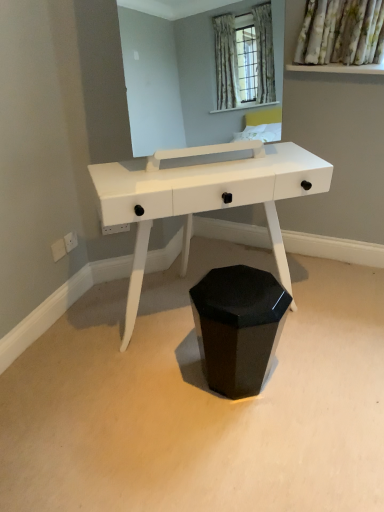
Locate an element on the screen. The width and height of the screenshot is (384, 512). vacant space that's between white glossy table at center and black glossy hexagonal waste bin at center is located at coordinates (271, 365).